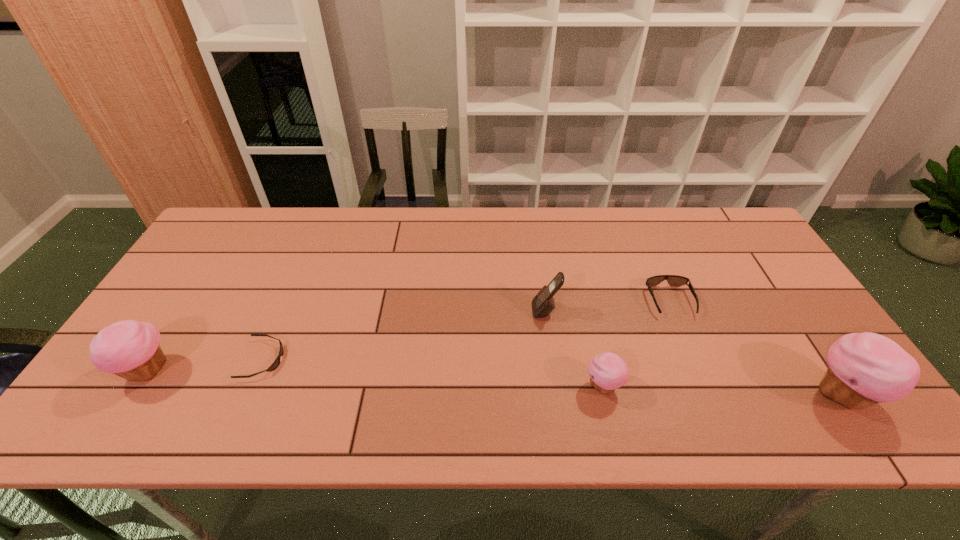
Select which object is the fifth closest to the rightmost object. Please provide its 2D coordinates. Your answer should be formatted as a tuple, i.e. [(x, y)], where the tuple contains the x and y coordinates of a point satisfying the conditions above.

[(130, 349)]

Locate an element on the screen. The width and height of the screenshot is (960, 540). cupcake that is the second nearest to the fifth object from left to right is located at coordinates (864, 369).

Identify which cupcake is the second nearest to the leftmost object. Please provide its 2D coordinates. Your answer should be formatted as a tuple, i.e. [(x, y)], where the tuple contains the x and y coordinates of a point satisfying the conditions above.

[(864, 369)]

Find the location of a particular element. This screenshot has height=540, width=960. free spot that satisfies the following two spatial constraints: 1. on the front-facing side of the right sunglasses; 2. on the front-facing side of the second object from left to right is located at coordinates (694, 360).

I want to click on vacant area that satisfies the following two spatial constraints: 1. on the front-facing side of the cellular telephone; 2. on the back side of the shortest cupcake, so pyautogui.click(x=556, y=387).

The height and width of the screenshot is (540, 960). In order to click on free location that satisfies the following two spatial constraints: 1. on the front-facing side of the fourth object from left to right; 2. on the right side of the cellular telephone in this screenshot , I will do `click(556, 387)`.

Locate an element on the screen. This screenshot has height=540, width=960. free space in the image that satisfies the following two spatial constraints: 1. on the front-facing side of the cellular telephone; 2. on the back side of the rightmost object is located at coordinates (557, 394).

Where is `blank space that satisfies the following two spatial constraints: 1. on the front-facing side of the shortest cupcake; 2. on the left side of the third object from left to right`? The height and width of the screenshot is (540, 960). blank space that satisfies the following two spatial constraints: 1. on the front-facing side of the shortest cupcake; 2. on the left side of the third object from left to right is located at coordinates (556, 387).

Where is `vacant area that satisfies the following two spatial constraints: 1. on the front-facing side of the rightmost cupcake; 2. on the left side of the second object from right to left`? vacant area that satisfies the following two spatial constraints: 1. on the front-facing side of the rightmost cupcake; 2. on the left side of the second object from right to left is located at coordinates (708, 394).

Image resolution: width=960 pixels, height=540 pixels. What are the coordinates of `free location that satisfies the following two spatial constraints: 1. on the front-facing side of the right sunglasses; 2. on the front-facing side of the shortest object` in the screenshot? It's located at (694, 360).